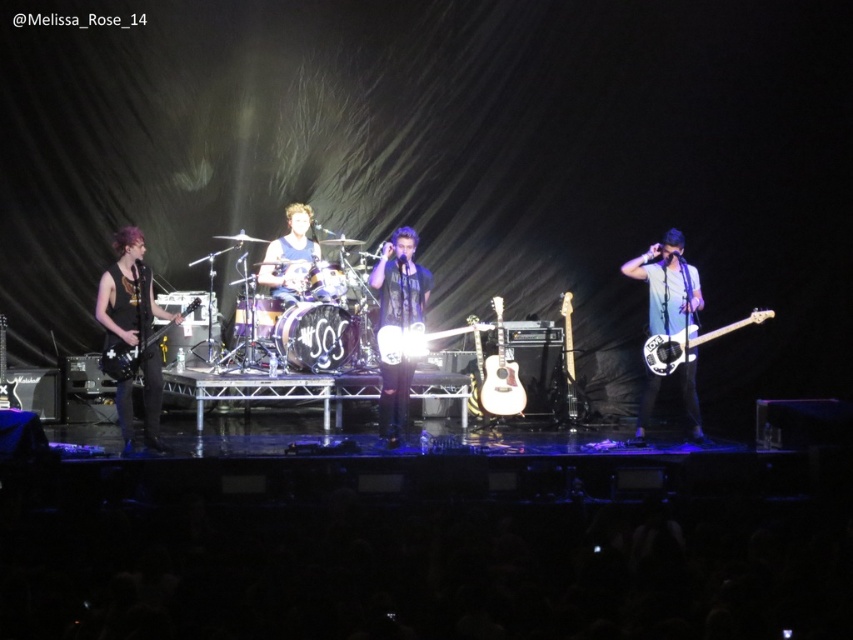
You are a photographer at the back of the venue and want to capture a closeup of the blue fabric shirt at center. Based on the coordinates provided, where should you aim your camera?

The blue fabric shirt at center is located at coordinates point (289, 257), so aim your camera there.

In the scene shown: You are a photographer setting up for a concert shoot. You have two instruments in view, the black matte guitar at left and the shiny silver bass at right. Based on their sizes, which instrument should you focus on to ensure it fills the frame better?

The black matte guitar at left is larger in size than the shiny silver bass at right, so focusing on the black matte guitar at left will fill the frame better.